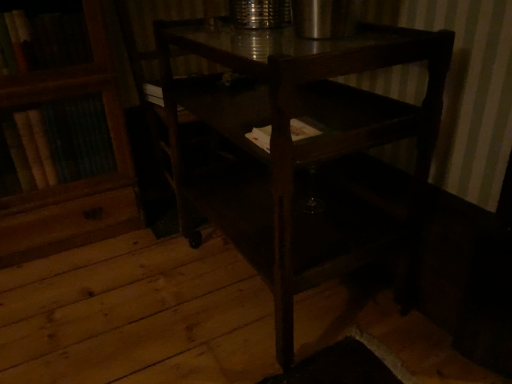
Question: Based on their positions, is dark wood table at center located to the left or right of white paper at center?

Choices:
 (A) left
 (B) right

Answer: (B)

Question: Based on their sizes in the image, would you say dark wood table at center is bigger or smaller than white paper at center?

Choices:
 (A) big
 (B) small

Answer: (A)

Question: In terms of width, does dark wood table at center look wider or thinner when compared to white paper at center?

Choices:
 (A) thin
 (B) wide

Answer: (B)

Question: Considering the positions of white paper at center and dark wood table at center in the image, is white paper at center bigger or smaller than dark wood table at center?

Choices:
 (A) big
 (B) small

Answer: (B)

Question: In terms of width, does white paper at center look wider or thinner when compared to dark wood table at center?

Choices:
 (A) thin
 (B) wide

Answer: (A)

Question: Based on their positions, is white paper at center located to the left or right of dark wood table at center?

Choices:
 (A) right
 (B) left

Answer: (B)

Question: From the image's perspective, is white paper at center above or below dark wood table at center?

Choices:
 (A) below
 (B) above

Answer: (B)